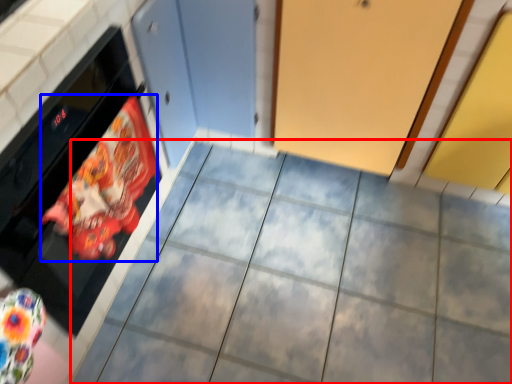
Question: Which object is closer to the camera taking this photo, ceramic tile (highlighted by a red box) or material (highlighted by a blue box)?

Choices:
 (A) ceramic tile
 (B) material

Answer: (B)